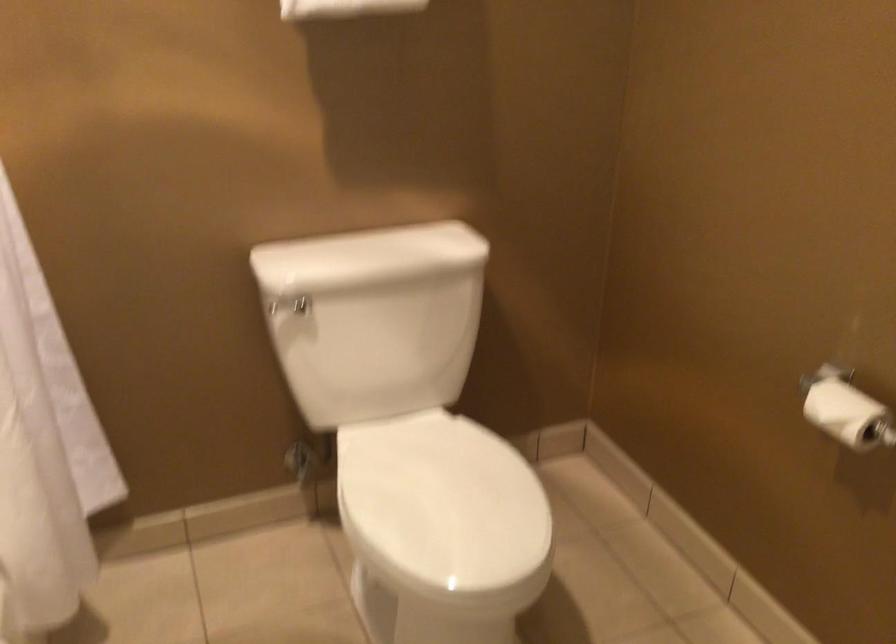
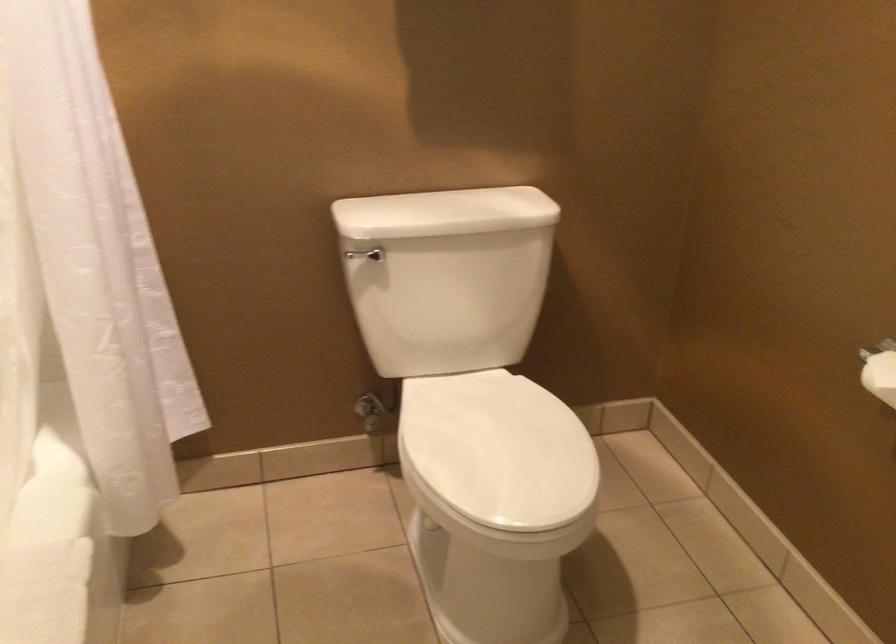
Find the pixel in the second image that matches (823,406) in the first image.

(880, 375)